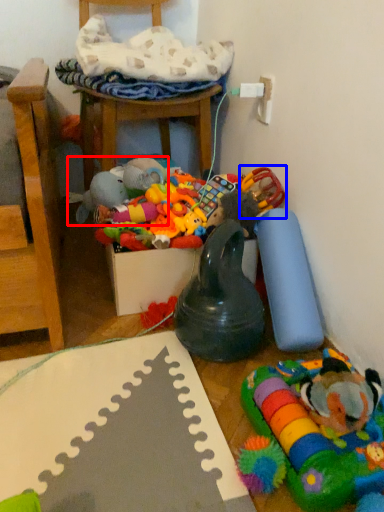
Question: Which point is closer to the camera, toy (highlighted by a red box) or toy (highlighted by a blue box)?

Choices:
 (A) toy
 (B) toy

Answer: (B)